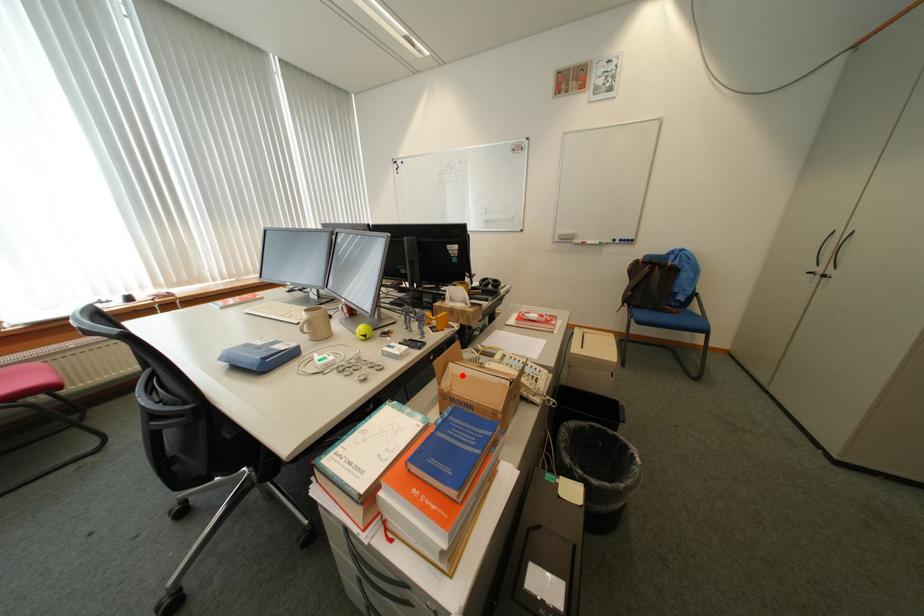
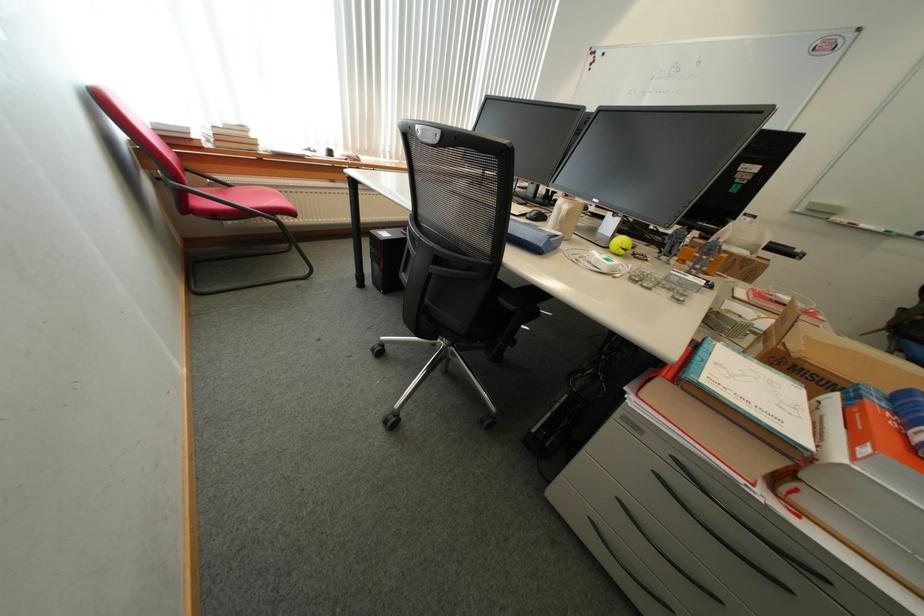
Where in the second image is the point corresponding to the highlighted location from the first image?

(816, 339)